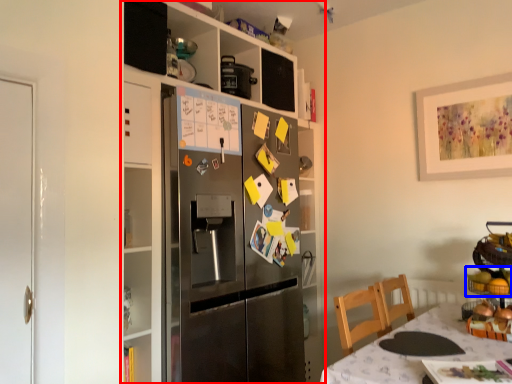
Question: Among these objects, which one is nearest to the camera, cabinetry (highlighted by a red box) or food (highlighted by a blue box)?

Choices:
 (A) cabinetry
 (B) food

Answer: (B)